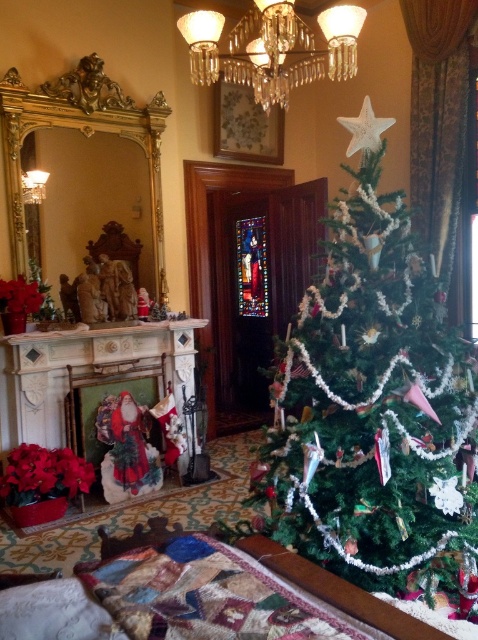
Does green matte christmas tree at center come behind clear crystal chandelier at upper center?

No, green matte christmas tree at center is closer to the viewer.

Between green matte christmas tree at center and clear crystal chandelier at upper center, which one has less height?

With less height is clear crystal chandelier at upper center.

Where is `green matte christmas tree at center`? green matte christmas tree at center is located at coordinates (375, 410).